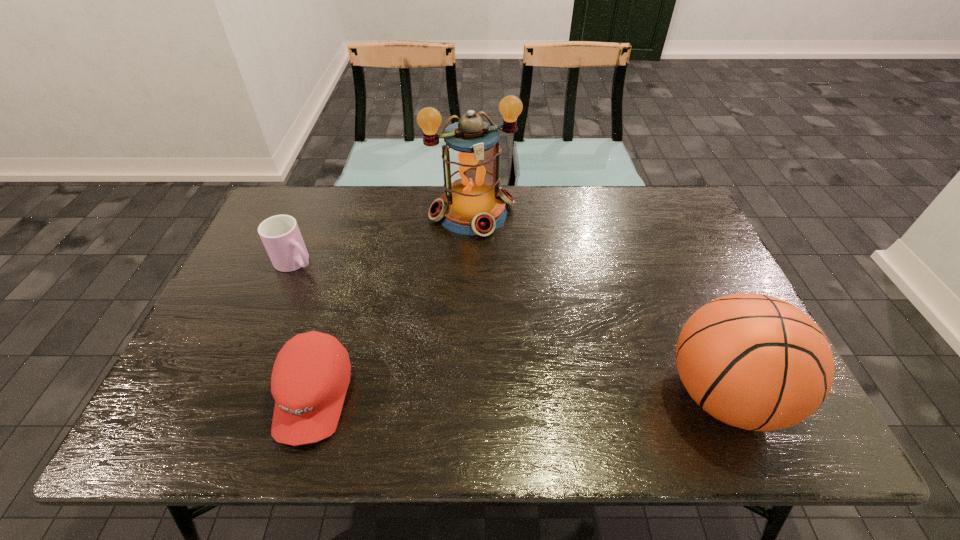
Image resolution: width=960 pixels, height=540 pixels. In order to click on free space on the desktop that is between the cap and the rightmost object and is positioned on the front-facing side of the third object from left to right in this screenshot , I will do `click(564, 395)`.

Image resolution: width=960 pixels, height=540 pixels. I want to click on vacant space on the desktop that is between the cap and the basketball and is positioned with the handle on the side of the second farthest object, so click(484, 395).